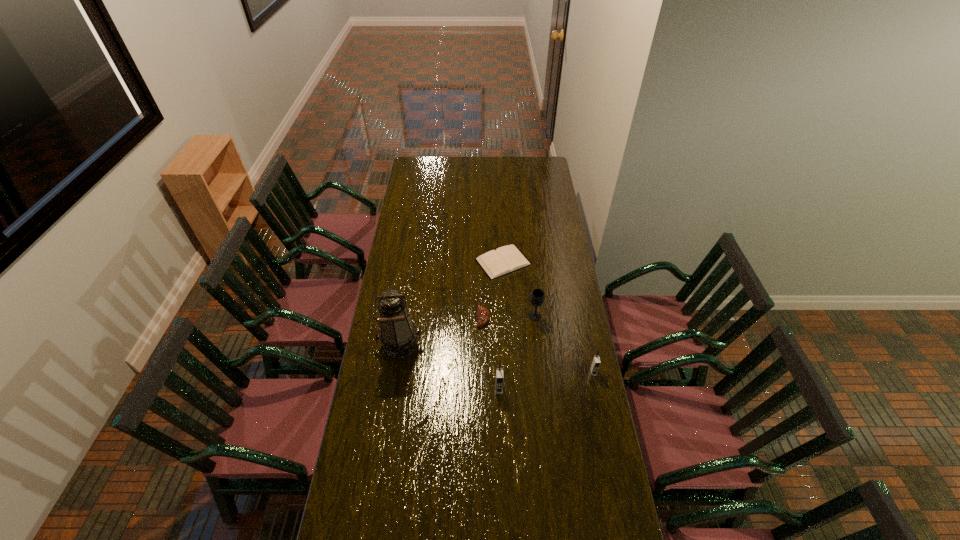
You are a GUI agent. You are given a task and a screenshot of the screen. Output one action in this format:
    pyautogui.click(x=<x>, y=<y>)
    Task: Click on the empty space that is in between the wineglass and the third nearest object
    
    Given the screenshot: What is the action you would take?
    pyautogui.click(x=468, y=330)

Locate an element on the screen. free point between the third nearest object and the hardback book is located at coordinates (452, 303).

Identify the location of vacant area that lies between the shortest object and the wineglass. Image resolution: width=960 pixels, height=540 pixels. (519, 289).

This screenshot has width=960, height=540. Find the location of `vacant space that is in between the fifth tallest object and the wineglass`. vacant space that is in between the fifth tallest object and the wineglass is located at coordinates (509, 317).

This screenshot has width=960, height=540. Identify the location of the second closest object relative to the wineglass. (506, 259).

Identify which object is located as the nearest to the farthest object. Please provide its 2D coordinates. Your answer should be formatted as a tuple, i.e. [(x, y)], where the tuple contains the x and y coordinates of a point satisfying the conditions above.

[(483, 315)]

The height and width of the screenshot is (540, 960). I want to click on blank area in the image that satisfies the following two spatial constraints: 1. on the front side of the farthest object; 2. on the left side of the wineglass, so click(x=506, y=316).

Find the location of `vacant area that satisfies the following two spatial constraints: 1. on the back side of the shortest object; 2. on the left side of the fifth tallest object`. vacant area that satisfies the following two spatial constraints: 1. on the back side of the shortest object; 2. on the left side of the fifth tallest object is located at coordinates click(x=483, y=262).